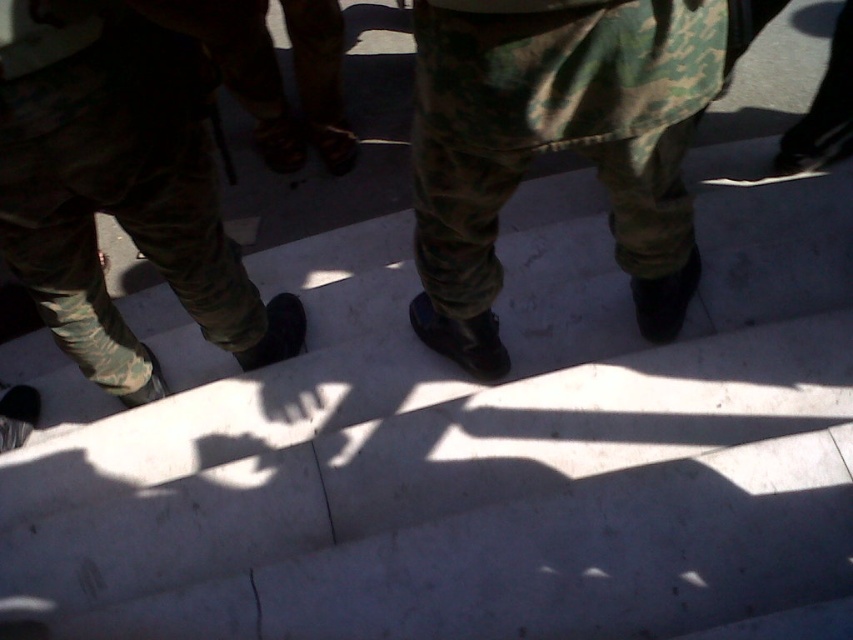
Who is positioned more to the left, camouflage pants at center or camouflage pants at left?

camouflage pants at left

Based on the photo, which is more to the right, camouflage pants at center or camouflage pants at left?

From the viewer's perspective, camouflage pants at center appears more on the right side.

Is point (628, 264) farther from viewer compared to point (138, 204)?

Yes, point (628, 264) is behind point (138, 204).

Find the location of `camouflage pants at center`. camouflage pants at center is located at coordinates (554, 145).